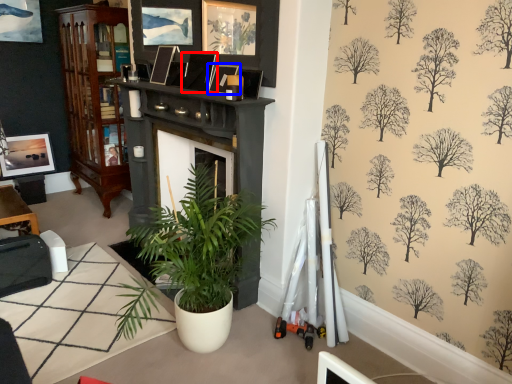
Question: Which of the following is the closest to the observer, picture frame (highlighted by a red box) or picture frame (highlighted by a blue box)?

Choices:
 (A) picture frame
 (B) picture frame

Answer: (B)